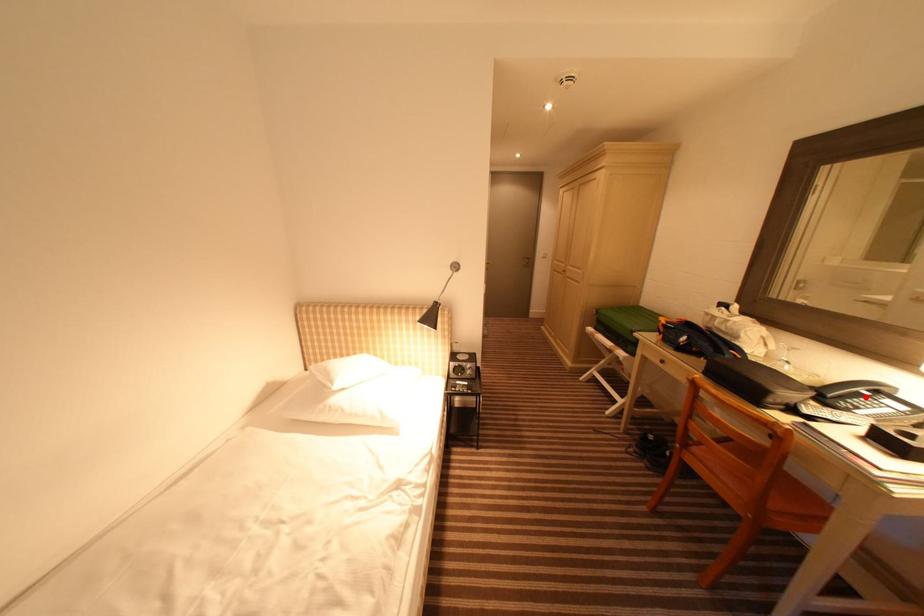
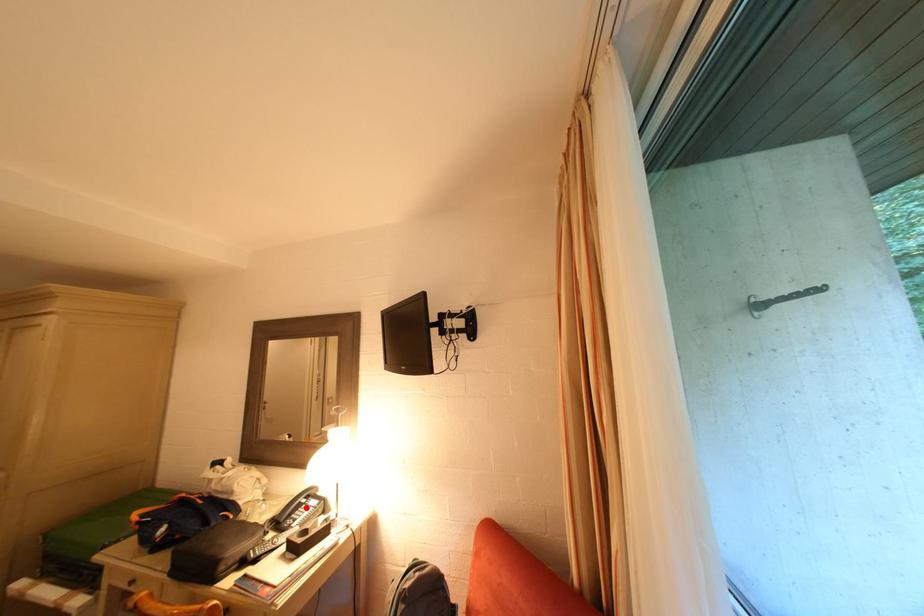
I am providing you with two images of the same scene from different viewpoints. A red point is marked on the first image and another point is marked on the second image. Does the point marked in image1 correspond to the same location as the one in image2?

Yes